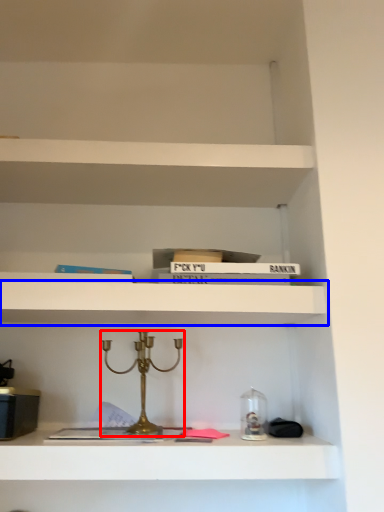
Question: Which object is closer to the camera taking this photo, candle holder (highlighted by a red box) or shelf (highlighted by a blue box)?

Choices:
 (A) candle holder
 (B) shelf

Answer: (A)